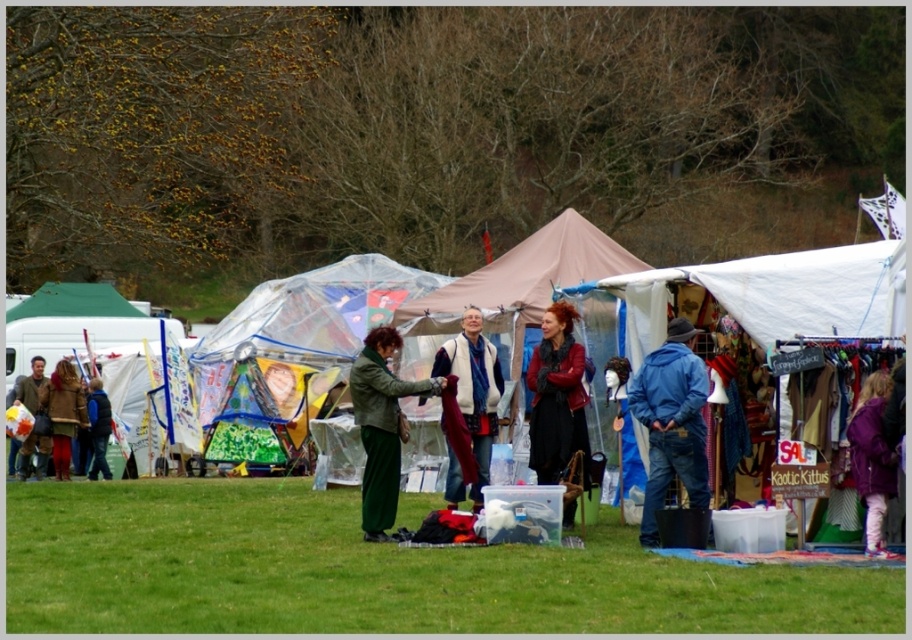
Which of these two, blue denim jacket at center or white fleece vest at center, stands shorter?

blue denim jacket at center is shorter.

Between blue denim jacket at center and white fleece vest at center, which one has more height?

With more height is white fleece vest at center.

Where is `blue denim jacket at center`? blue denim jacket at center is located at coordinates (x=671, y=422).

This screenshot has height=640, width=912. In order to click on blue denim jacket at center in this screenshot , I will do pyautogui.click(x=671, y=422).

Who is positioned more to the left, purple fleece jacket at lower right or matte brown coat at lower left?

Positioned to the left is matte brown coat at lower left.

Is purple fleece jacket at lower right taller than matte brown coat at lower left?

No.

You are a GUI agent. You are given a task and a screenshot of the screen. Output one action in this format:
    pyautogui.click(x=<x>, y=<y>)
    Task: Click on the purple fleece jacket at lower right
    The height and width of the screenshot is (640, 912).
    Given the screenshot: What is the action you would take?
    pyautogui.click(x=872, y=460)

Identify the location of purple fleece jacket at lower right. (872, 460).

Who is positioned more to the right, white fabric tent at center-right or matte black jacket at center?

Positioned to the right is white fabric tent at center-right.

Can you confirm if white fabric tent at center-right is wider than matte black jacket at center?

Correct, the width of white fabric tent at center-right exceeds that of matte black jacket at center.

Is point (622, 298) closer to camera compared to point (88, 401)?

Yes, it is in front of point (88, 401).

At what (x,y) coordinates should I click in order to perform the action: click on white fabric tent at center-right. Please return your answer as a coordinate pair (x, y). This screenshot has height=640, width=912. Looking at the image, I should click on (771, 296).